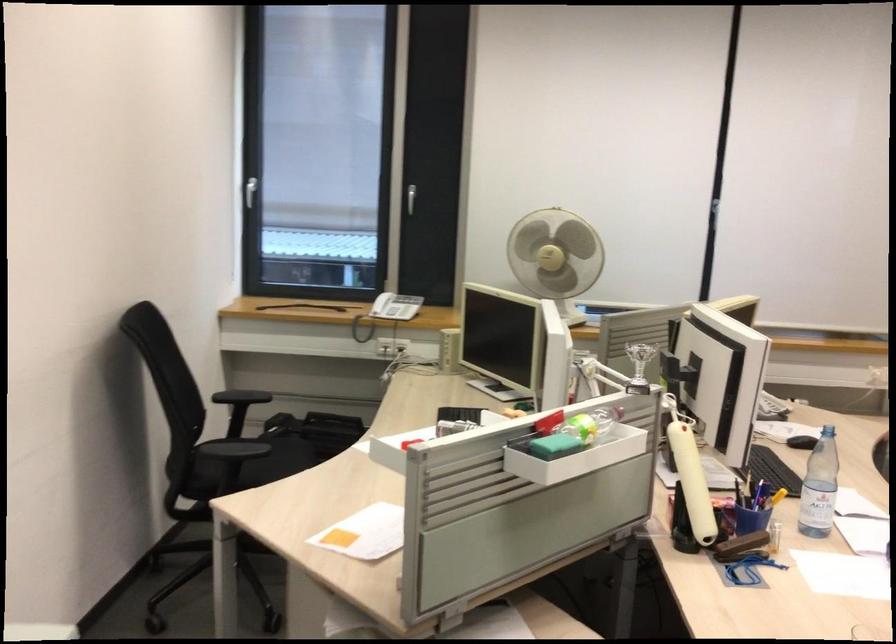
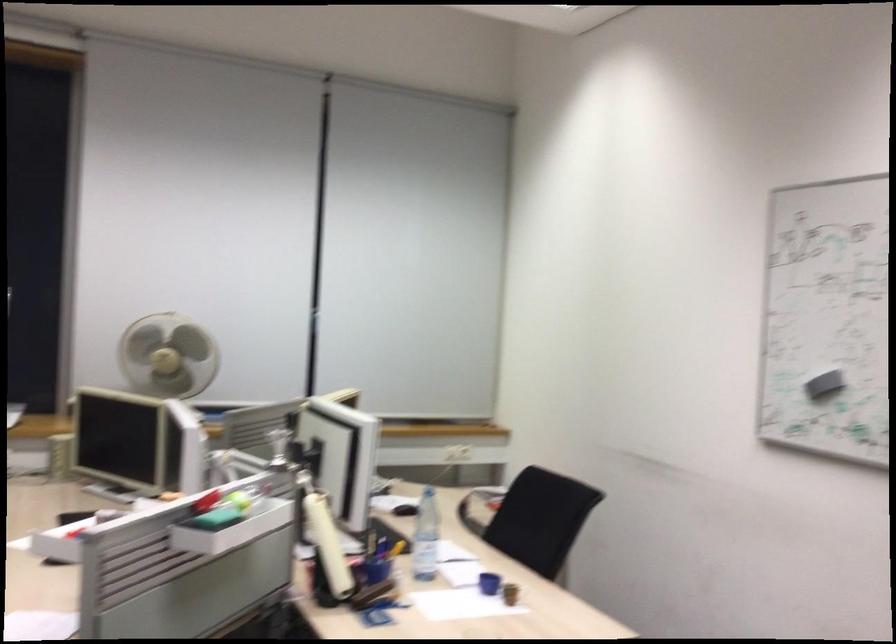
Where in the second image is the point corresponding to the point at 560,240 from the first image?

(168, 355)